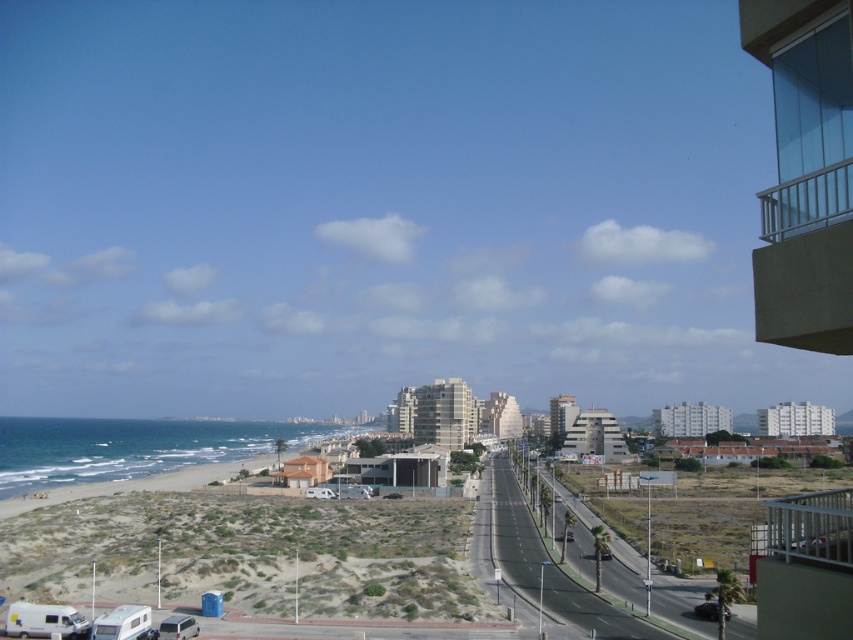
You are a photographer standing on the beach and want to capture a photo of the white matte camper at lower left without any obstructions. Is the metallic silver railing at upper right blocking your view of the camper?

The metallic silver railing at upper right is much taller than the white matte camper at lower left, so it might block your view depending on your position. To ensure the camper is visible, position yourself lower or move to a spot where the railing doesn

You are standing at the camera position and want to take a photo of the clear glass balcony at upper right. If your camera has a maximum focus range of 10 meters, will you be able to capture it clearly?

The clear glass balcony at upper right is 9.29 meters away from the camera, which is within the maximum focus range of 10 meters. Therefore, you can capture it clearly.

You are a delivery drone that needs to deliver a package to the clear glass balcony at upper right. However, there is a metallic silver railing at upper right in the way. Can your drone safely navigate between them without hitting either structure?

The clear glass balcony at upper right and metallic silver railing at upper right are 16.20 meters apart, so the drone can safely navigate between them as the distance is more than sufficient for safe passage.